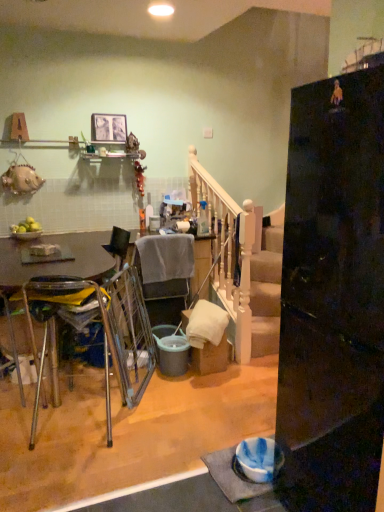
Question: Is the surface of glossy black refrigerator at right in direct contact with translucent glass bottle at upper center?

Choices:
 (A) yes
 (B) no

Answer: (B)

Question: Is glossy black refrigerator at right oriented towards translucent glass bottle at upper center?

Choices:
 (A) yes
 (B) no

Answer: (B)

Question: Is glossy black refrigerator at right smaller than translucent glass bottle at upper center?

Choices:
 (A) no
 (B) yes

Answer: (A)

Question: Is glossy black refrigerator at right to the right of translucent glass bottle at upper center from the viewer's perspective?

Choices:
 (A) yes
 (B) no

Answer: (A)

Question: Does glossy black refrigerator at right have a larger size compared to translucent glass bottle at upper center?

Choices:
 (A) yes
 (B) no

Answer: (A)

Question: Is glossy black refrigerator at right positioned with its back to translucent glass bottle at upper center?

Choices:
 (A) yes
 (B) no

Answer: (B)

Question: Is the position of metallic silver swivel chair at center more distant than that of white wooden rail at center?

Choices:
 (A) no
 (B) yes

Answer: (A)

Question: Is the depth of metallic silver swivel chair at center less than that of white wooden rail at center?

Choices:
 (A) yes
 (B) no

Answer: (A)

Question: Considering the relative sizes of metallic silver swivel chair at center and white wooden rail at center in the image provided, is metallic silver swivel chair at center wider than white wooden rail at center?

Choices:
 (A) yes
 (B) no

Answer: (A)

Question: Does metallic silver swivel chair at center have a lesser height compared to white wooden rail at center?

Choices:
 (A) yes
 (B) no

Answer: (A)

Question: Does metallic silver swivel chair at center appear on the left side of white wooden rail at center?

Choices:
 (A) yes
 (B) no

Answer: (A)

Question: Can you confirm if metallic silver swivel chair at center is smaller than white wooden rail at center?

Choices:
 (A) no
 (B) yes

Answer: (B)

Question: Can you confirm if matte gray bucket at center is shorter than white wooden rail at center?

Choices:
 (A) no
 (B) yes

Answer: (B)